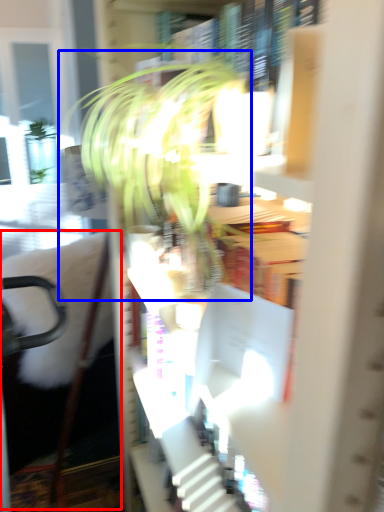
Question: Which object appears farthest to the camera in this image, swivel chair (highlighted by a red box) or houseplant (highlighted by a blue box)?

Choices:
 (A) swivel chair
 (B) houseplant

Answer: (B)